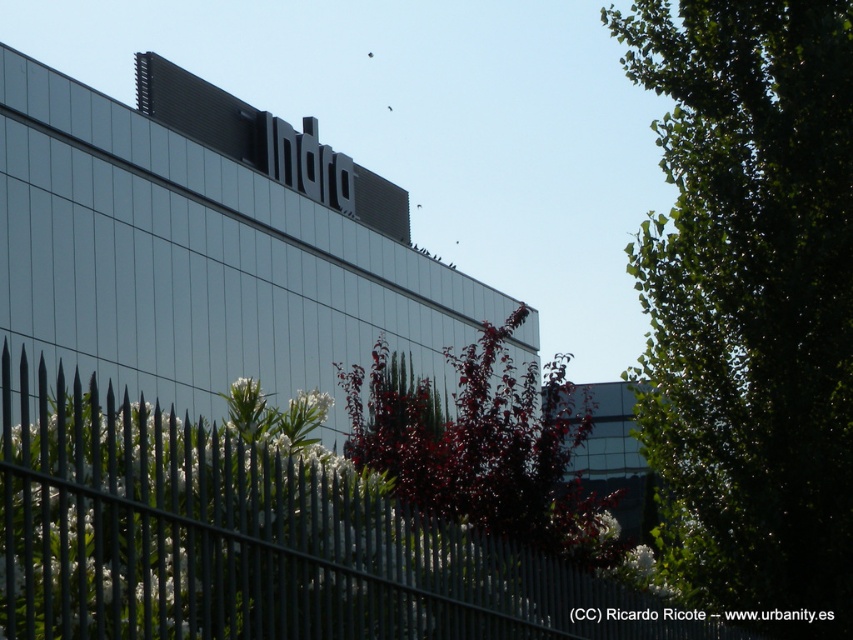
In the scene shown: You are standing in front of the building and want to locate two points marked on the image. The first is at point (728, 220) and the second at point (566, 534). Which point is closer to you?

Point (728, 220) is closer to you because it is further to the viewer than point (566, 534).

You are an architect evaluating the visibility of the green leafy tree at right from the building entrance. Considering the presence of the metallic gray fence at lower left, which object would block the view first if you were standing at the entrance facing the tree?

The metallic gray fence at lower left would block the view first because it is closer to the entrance than the green leafy tree at right.

You are standing in front of the building named Indra. You see a point labeled with coordinates at point (252,541). What object is located at that point?

The point at (252,541) indicates the metallic gray fence at lower left.